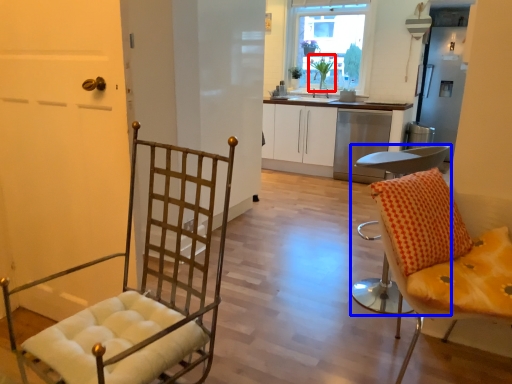
Question: Which point is closer to the camera, houseplant (highlighted by a red box) or chair (highlighted by a blue box)?

Choices:
 (A) houseplant
 (B) chair

Answer: (B)